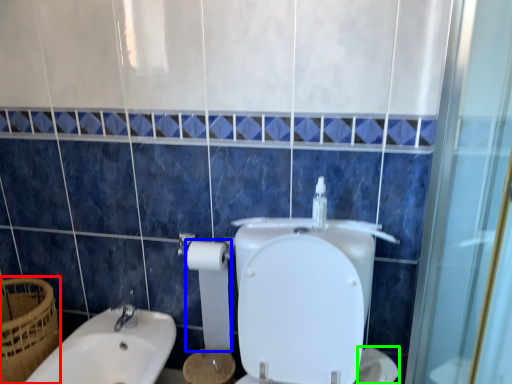
Question: Considering the real-world distances, which object is closest to basket (highlighted by a red box)? toilet paper (highlighted by a blue box) or toilet paper (highlighted by a green box).

Choices:
 (A) toilet paper
 (B) toilet paper

Answer: (A)